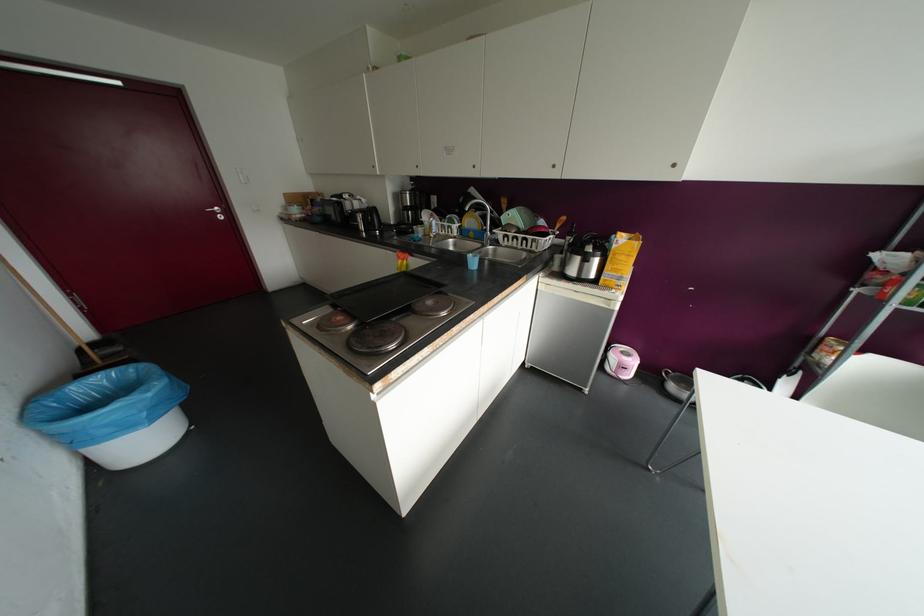
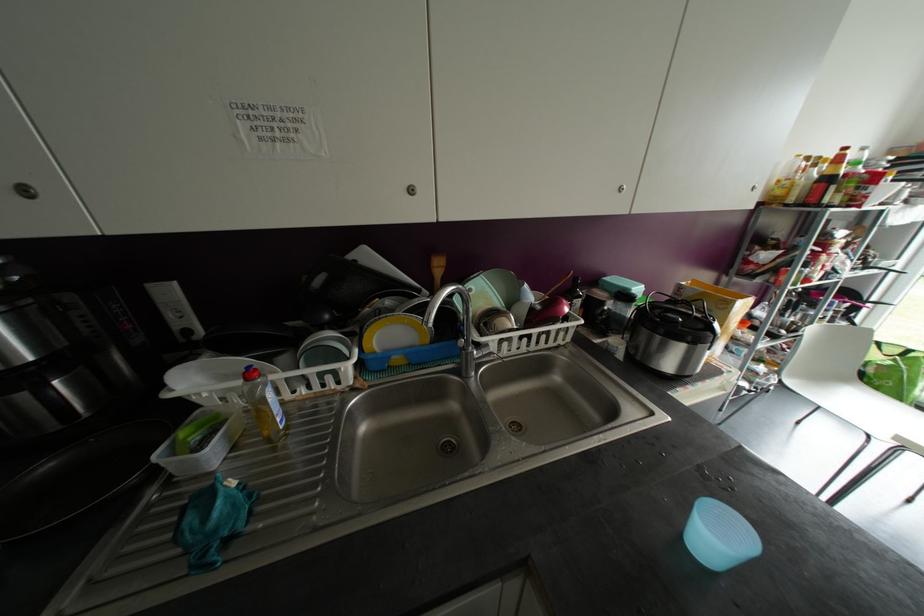
Where in the second image is the point corresponding to (x=434, y=236) from the first image?

(286, 427)